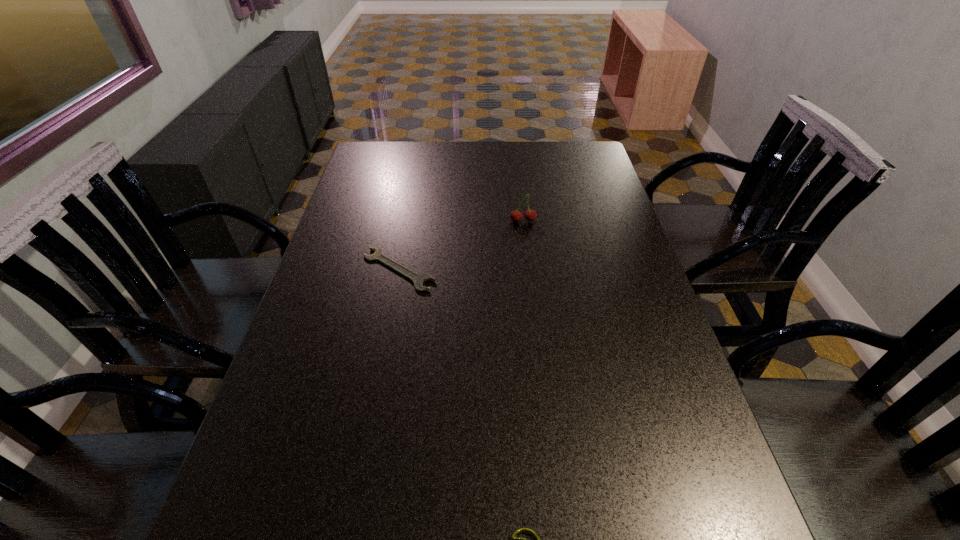
The height and width of the screenshot is (540, 960). In the image, there is a desktop. Find the location of `blank space at the far right corner`. blank space at the far right corner is located at coordinates (567, 145).

This screenshot has width=960, height=540. I want to click on free space between the farthest object and the leftmost object, so click(461, 245).

Select which object is the closest to the leftmost object. Please provide its 2D coordinates. Your answer should be formatted as a tuple, i.e. [(x, y)], where the tuple contains the x and y coordinates of a point satisfying the conditions above.

[(530, 215)]

Locate which object is the closest to the second farthest object. Please provide its 2D coordinates. Your answer should be formatted as a tuple, i.e. [(x, y)], where the tuple contains the x and y coordinates of a point satisfying the conditions above.

[(530, 215)]